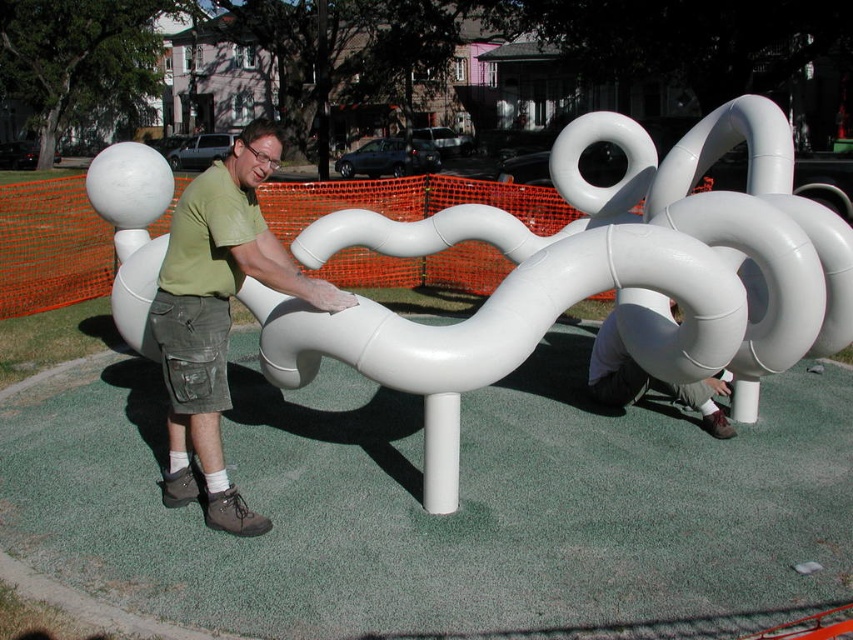
Which is above, green matte shirt at center or white matte tube at lower center?

green matte shirt at center is above.

Is green matte shirt at center closer to the viewer compared to white matte tube at lower center?

Yes.

Where is `green matte shirt at center`? The height and width of the screenshot is (640, 853). green matte shirt at center is located at coordinates (218, 316).